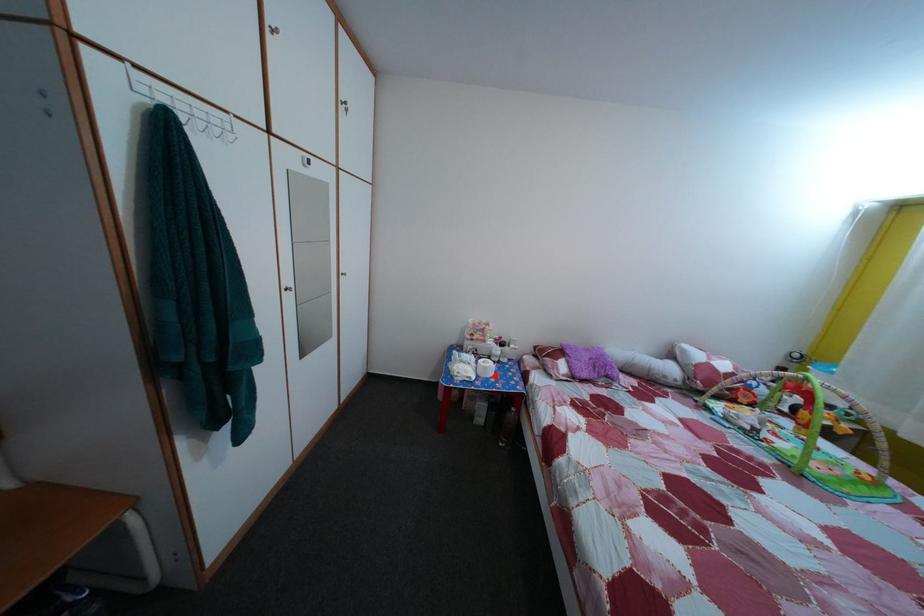
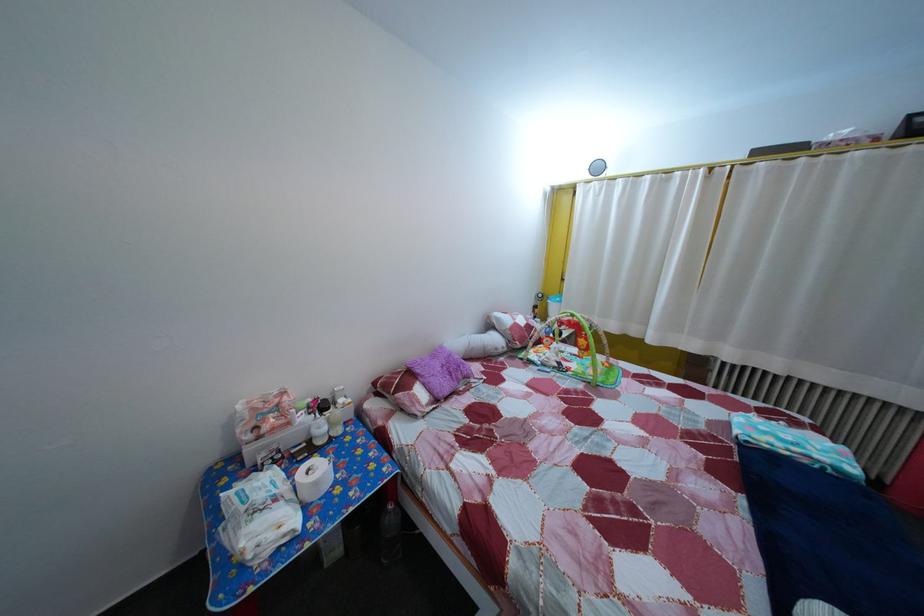
The point at the highlighted location is marked in the first image. Where is the corresponding point in the second image?

(325, 491)